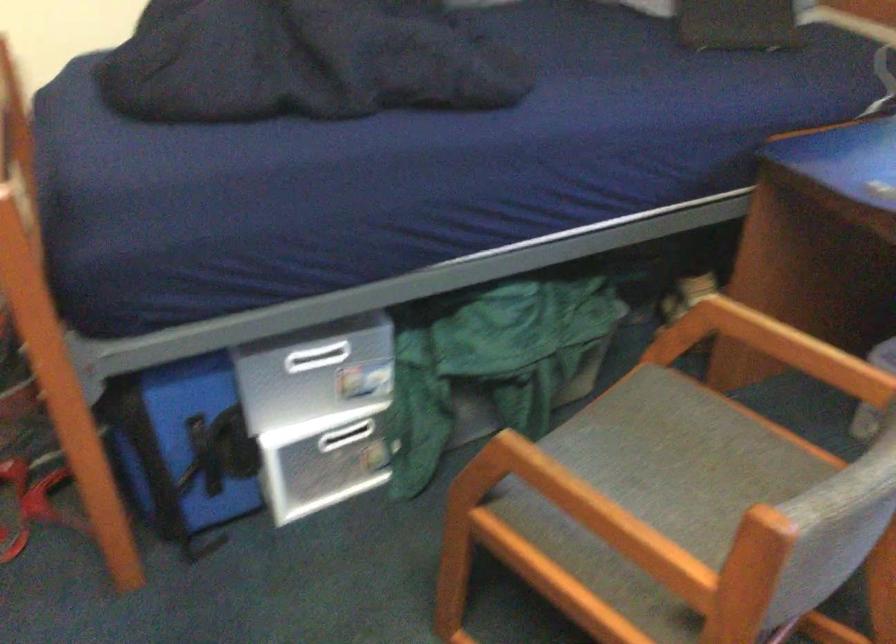
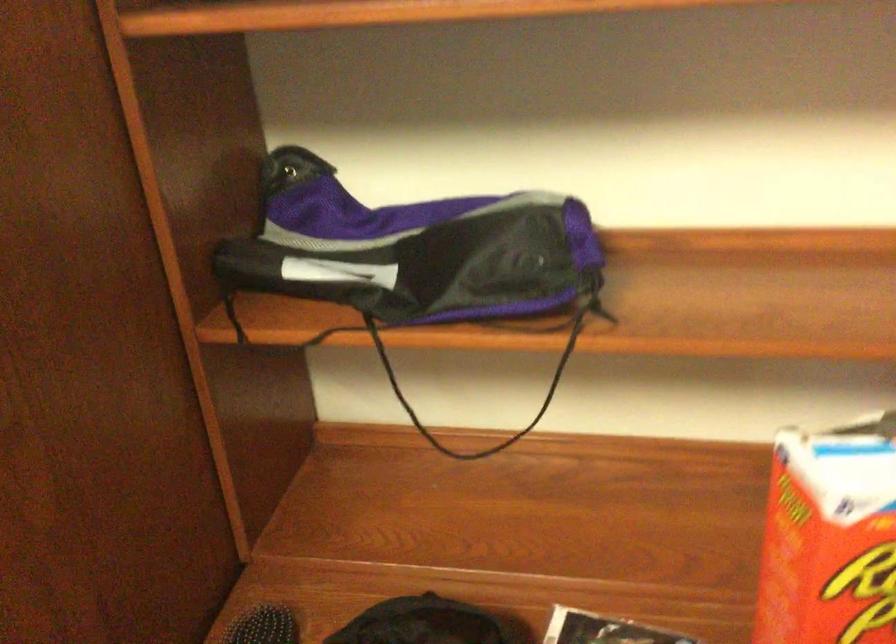
Question: The camera is either moving clockwise (left) or counter-clockwise (right) around the object. The first image is from the beginning of the video and the second image is from the end. Is the camera moving left or right when shooting the video?

Choices:
 (A) Left
 (B) Right

Answer: (B)